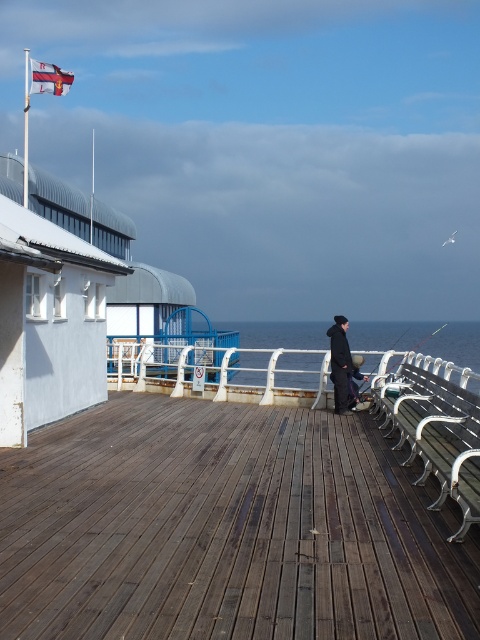
Question: Can you confirm if white metal rail at center is positioned below green metal bench at right?

Choices:
 (A) no
 (B) yes

Answer: (B)

Question: Which point is farther to the camera?

Choices:
 (A) brown wooden deck at center
 (B) green metal bench at right
 (C) metallic fishing pole at right
 (D) white metal rail at center

Answer: (C)

Question: Based on their relative distances, which object is nearer to the white metal rail at center?

Choices:
 (A) metallic fishing pole at right
 (B) green metal bench at right
 (C) brown wooden deck at center

Answer: (C)

Question: Can you confirm if green metal bench at right is positioned below dark blue fabric coat at center?

Choices:
 (A) no
 (B) yes

Answer: (B)

Question: Can you confirm if brown wooden deck at center is thinner than green metal bench at right?

Choices:
 (A) no
 (B) yes

Answer: (A)

Question: Which point is farther from the camera taking this photo?

Choices:
 (A) click(x=241, y=566)
 (B) click(x=337, y=364)
 (C) click(x=408, y=326)
 (D) click(x=309, y=388)

Answer: (C)